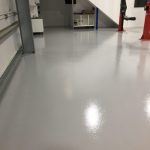
Where is `cabinet`? The width and height of the screenshot is (150, 150). cabinet is located at coordinates (35, 10).